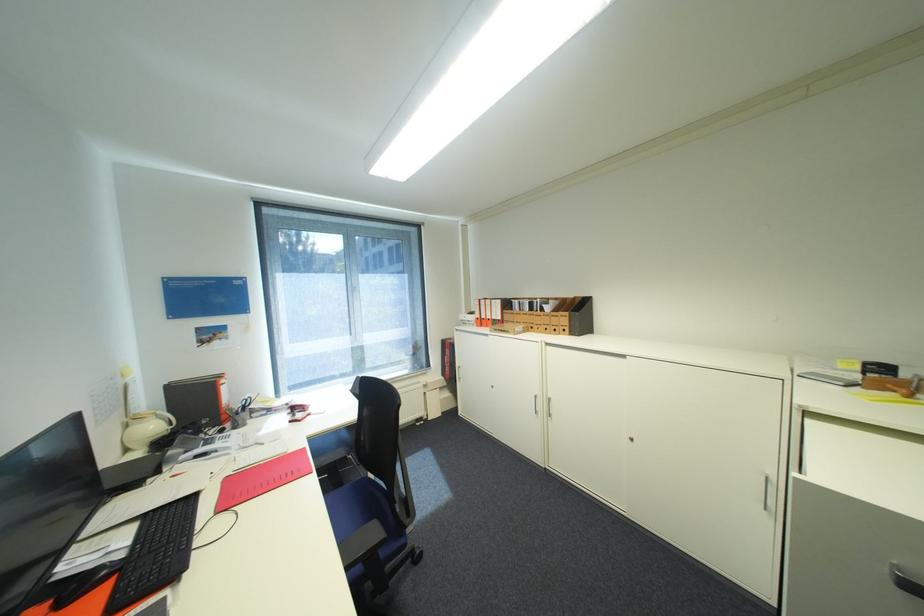
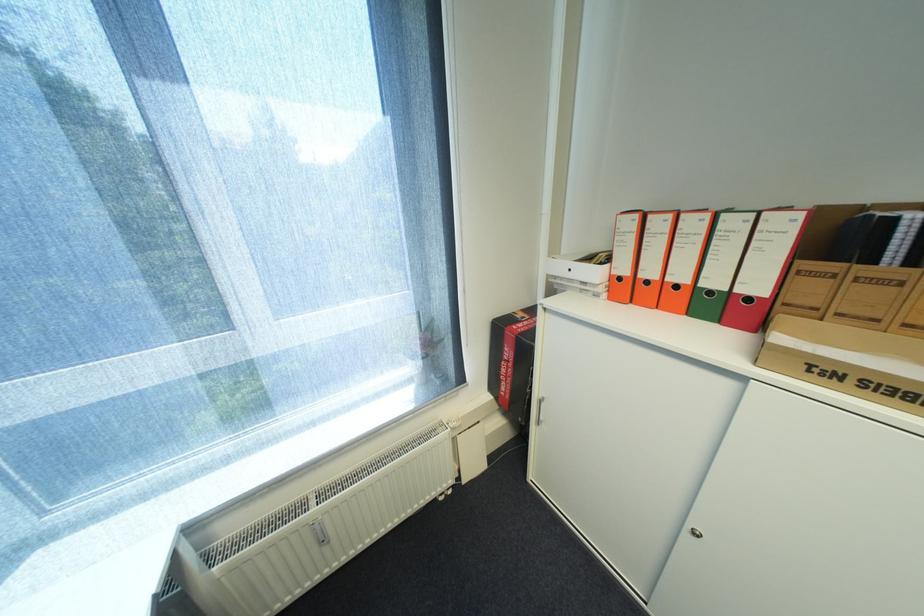
Question: In a continuous first-person perspective shot, in which direction is the camera moving?

Choices:
 (A) Left
 (B) Right
 (C) Forward
 (D) Backward

Answer: (C)